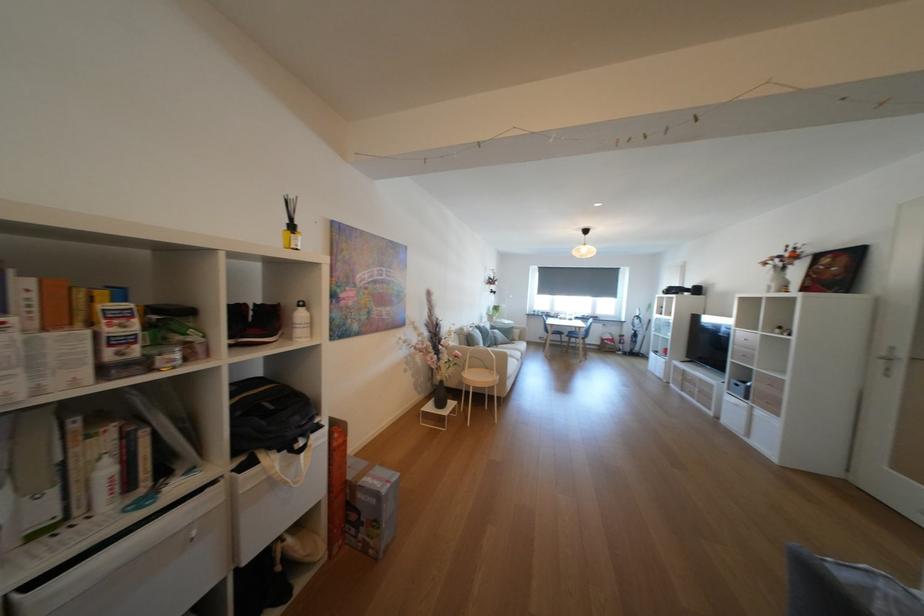
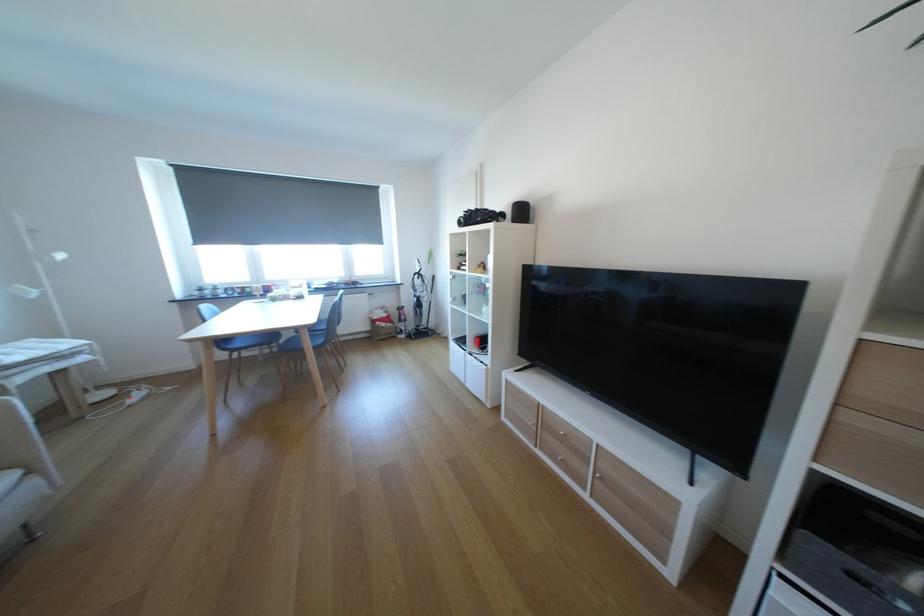
Where in the second image is the point corresponding to (699,292) from the first image?

(514, 217)